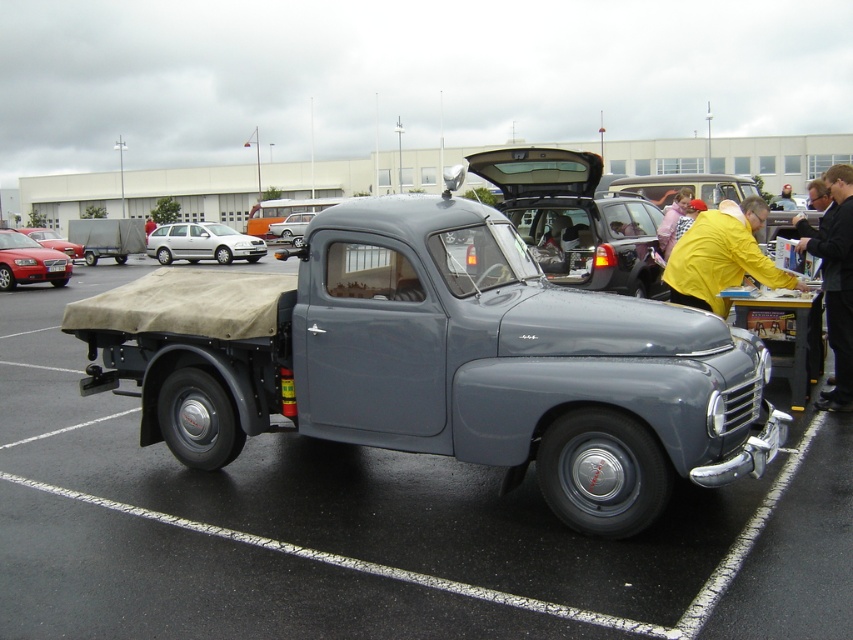
Question: Can you confirm if yellow fabric shirt at right is positioned above silver metallic hatchback at left?

Choices:
 (A) yes
 (B) no

Answer: (B)

Question: Can you confirm if metallic gray truck at center is wider than silver metallic sedan at center?

Choices:
 (A) no
 (B) yes

Answer: (B)

Question: Estimate the real-world distances between objects in this image. Which object is farther from the yellow fabric shirt at right?

Choices:
 (A) silver metallic hatchback at left
 (B) silver metallic sedan at center
 (C) matte black car at left

Answer: (B)

Question: Does silver metallic hatchback at left appear under matte red car at left?

Choices:
 (A) yes
 (B) no

Answer: (B)

Question: Based on their relative distances, which object is farther from the matte red car at left?

Choices:
 (A) metallic gray truck at center
 (B) silver metallic sedan at center
 (C) yellow fabric shirt at right
 (D) silver metallic hatchback at left

Answer: (B)

Question: Which is farther from the matte red car at left?

Choices:
 (A) yellow fabric at right
 (B) silver metallic sedan at center
 (C) matte black car at left

Answer: (B)